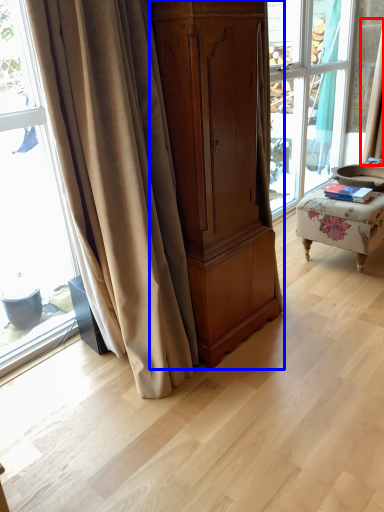
Question: Which of the following is the farthest to the observer, curtain (highlighted by a red box) or cabinetry (highlighted by a blue box)?

Choices:
 (A) curtain
 (B) cabinetry

Answer: (A)